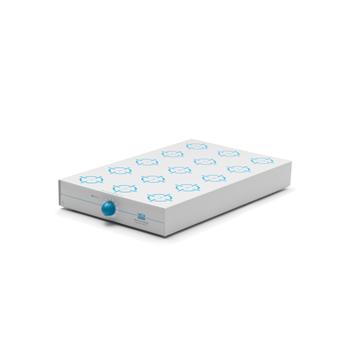
Locate an element on the screen. box is located at coordinates (193, 170).